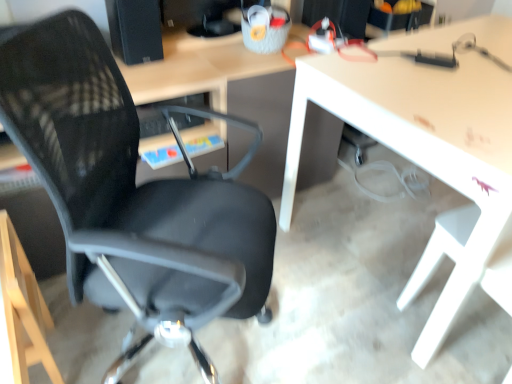
Question: Is black matte speaker at upper left located within black mesh chair at left?

Choices:
 (A) yes
 (B) no

Answer: (B)

Question: From a real-world perspective, does black mesh chair at left stand above black matte speaker at upper left?

Choices:
 (A) yes
 (B) no

Answer: (B)

Question: Does black mesh chair at left have a smaller size compared to black matte speaker at upper left?

Choices:
 (A) yes
 (B) no

Answer: (B)

Question: Is black mesh chair at left closer to camera compared to black matte speaker at upper left?

Choices:
 (A) no
 (B) yes

Answer: (B)

Question: Does black mesh chair at left appear on the right side of black matte speaker at upper left?

Choices:
 (A) no
 (B) yes

Answer: (B)

Question: From a real-world perspective, is black mesh chair at left located beneath black matte speaker at upper left?

Choices:
 (A) no
 (B) yes

Answer: (B)

Question: Can you confirm if white glossy table at center is wider than black mesh chair at left?

Choices:
 (A) yes
 (B) no

Answer: (A)

Question: Does white glossy table at center have a greater height compared to black mesh chair at left?

Choices:
 (A) no
 (B) yes

Answer: (A)

Question: Is the position of white glossy table at center less distant than that of black mesh chair at left?

Choices:
 (A) yes
 (B) no

Answer: (B)

Question: From the image's perspective, does white glossy table at center appear lower than black mesh chair at left?

Choices:
 (A) yes
 (B) no

Answer: (B)

Question: From a real-world perspective, is white glossy table at center located higher than black mesh chair at left?

Choices:
 (A) no
 (B) yes

Answer: (A)

Question: Could you tell me if white glossy table at center is turned towards black mesh chair at left?

Choices:
 (A) no
 (B) yes

Answer: (A)

Question: Is black mesh chair at left at the right side of white glossy table at center?

Choices:
 (A) no
 (B) yes

Answer: (A)